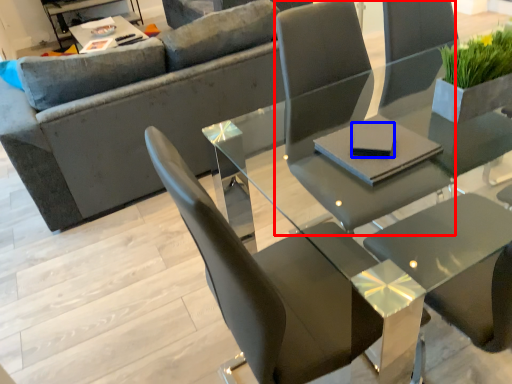
Question: Which of the following is the farthest to the observer, chair (highlighted by a red box) or pad (highlighted by a blue box)?

Choices:
 (A) chair
 (B) pad

Answer: (B)